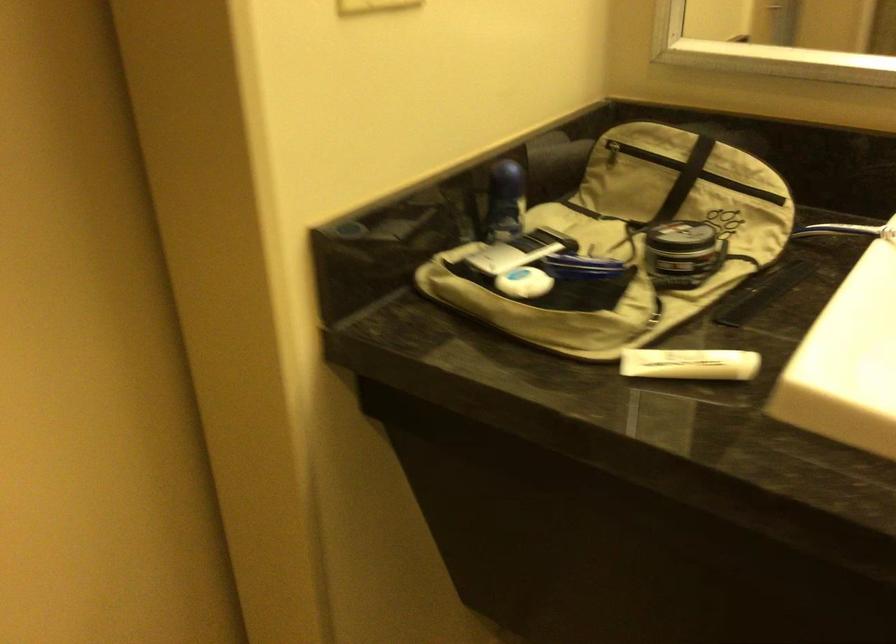
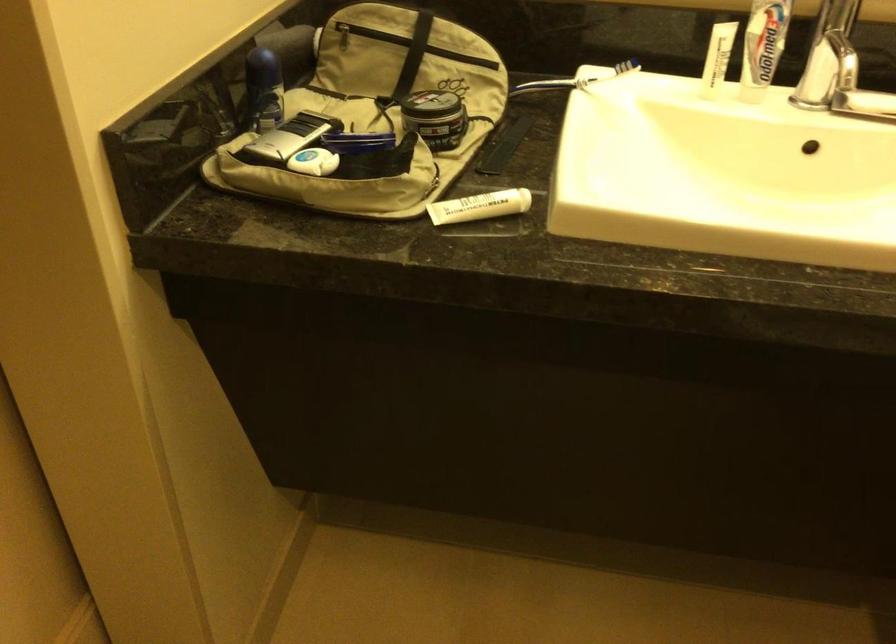
Where in the second image is the point corresponding to [681,237] from the first image?

(433, 105)